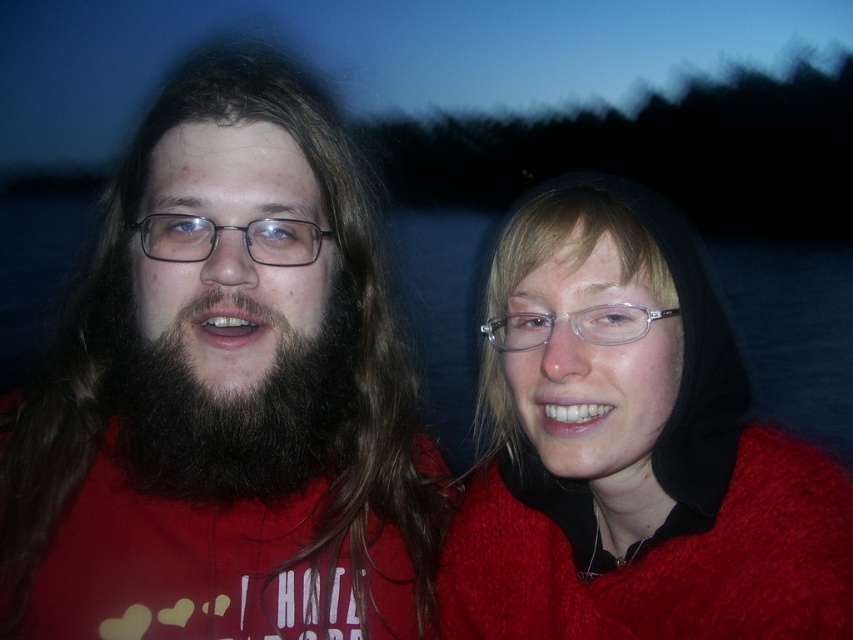
Question: Which object is positioned closest to the dark brown thick hair at left?

Choices:
 (A) matte black glasses at left
 (B) matte black beard at left

Answer: (B)

Question: Is matte red sweater at right to the left of matte black glasses at left from the viewer's perspective?

Choices:
 (A) yes
 (B) no

Answer: (B)

Question: Does matte black beard at left appear on the right side of clear plastic glasses at center?

Choices:
 (A) yes
 (B) no

Answer: (B)

Question: Can you confirm if matte black beard at left is smaller than dark brown thick hair at left?

Choices:
 (A) no
 (B) yes

Answer: (A)

Question: Among these objects, which one is nearest to the camera?

Choices:
 (A) clear plastic glasses at center
 (B) matte black beard at left
 (C) matte black glasses at left
 (D) dark brown thick hair at left

Answer: (A)

Question: Which point is farther from the camera taking this photo?

Choices:
 (A) (286, 241)
 (B) (642, 348)

Answer: (A)